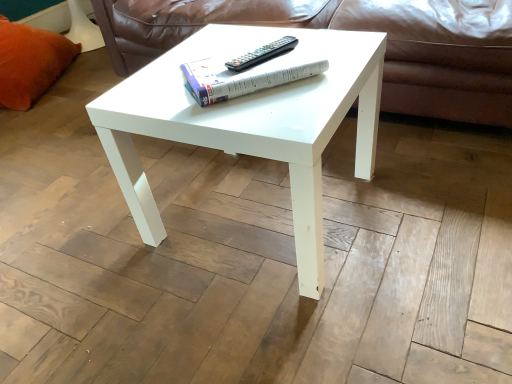
The width and height of the screenshot is (512, 384). I want to click on vacant space to the right of white paper at center, so click(334, 52).